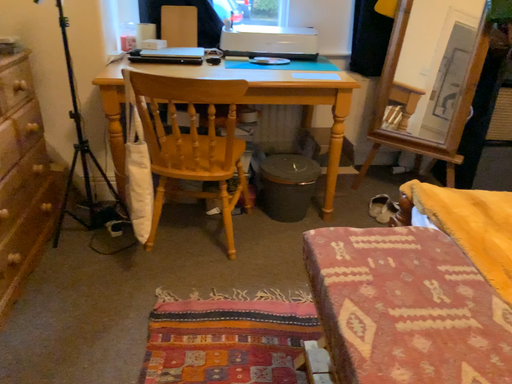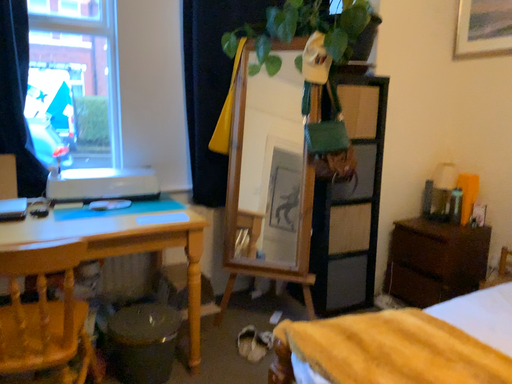
Question: How did the camera likely rotate when shooting the video?

Choices:
 (A) rotated right
 (B) rotated left

Answer: (A)